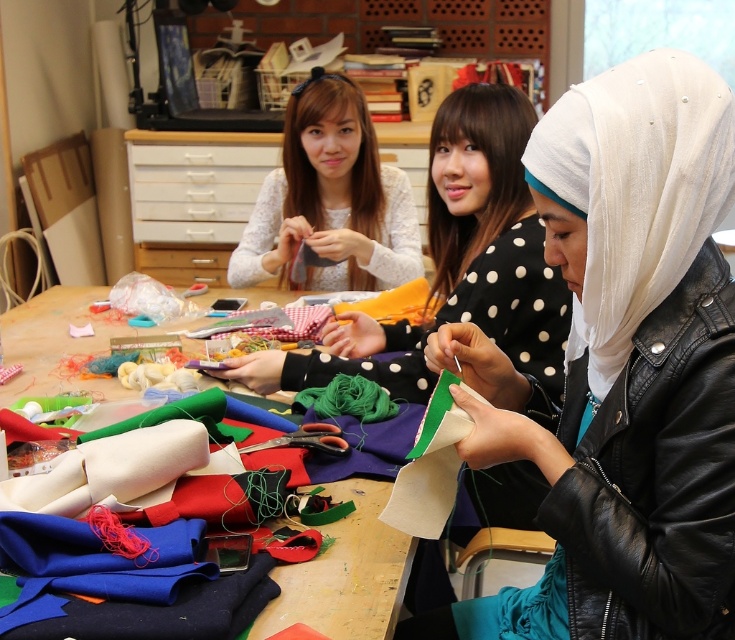
Who is more forward, (506, 180) or (82, 320)?

Point (506, 180) is in front.

Who is lower down, matte white hijab at upper right or fabric-covered table at center?

fabric-covered table at center

Which is in front, point (505, 264) or point (10, 388)?

Point (505, 264) is more forward.

This screenshot has height=640, width=735. Identify the location of matte white hijab at upper right. (456, 264).

Identify the location of matte white hijab at upper right. (456, 264).

Is point (509, 512) positioned behind point (512, 500)?

No, (509, 512) is closer to viewer.

The image size is (735, 640). What are the coordinates of `matte white hijab at upper right` in the screenshot? It's located at (456, 264).

Is the position of white lace shirt at upper center less distant than that of green felt fabric at center?

No.

Does white lace shirt at upper center have a lesser width compared to green felt fabric at center?

In fact, white lace shirt at upper center might be wider than green felt fabric at center.

Which is in front, point (254, 227) or point (387, 342)?

Point (387, 342) is more forward.

Locate an element on the screen. This screenshot has width=735, height=640. white lace shirt at upper center is located at coordinates (329, 198).